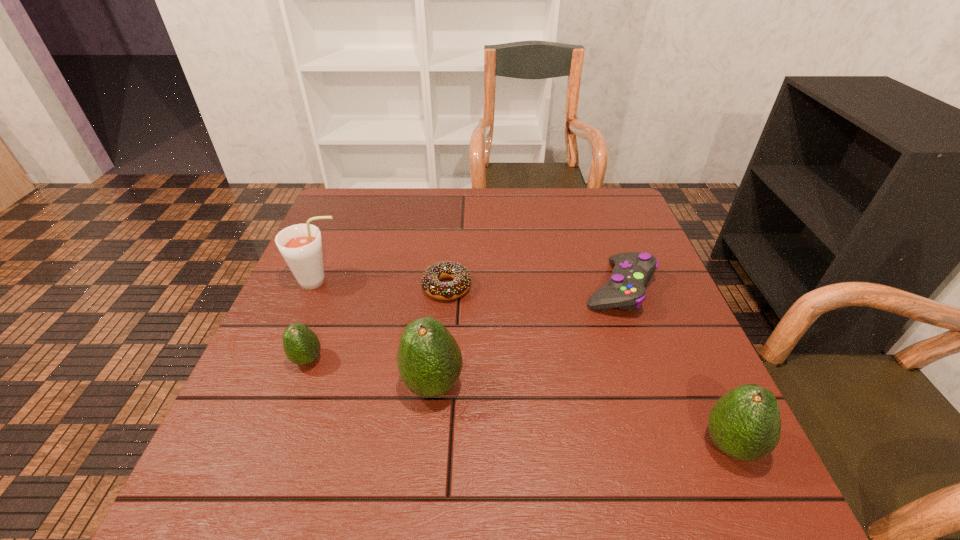
In the image, there is a desktop. Identify the location of free space at the near edge. This screenshot has width=960, height=540. (493, 412).

Image resolution: width=960 pixels, height=540 pixels. I want to click on free space at the left edge, so click(358, 267).

Where is `free space at the right edge of the desktop`? This screenshot has width=960, height=540. free space at the right edge of the desktop is located at coordinates (607, 234).

The width and height of the screenshot is (960, 540). I want to click on free space at the far left corner of the desktop, so click(353, 228).

Identify the location of free space at the far right corner of the desktop. The image size is (960, 540). (614, 209).

In order to click on vacant space that is in between the control and the second avocado from left to right in this screenshot , I will do `click(526, 336)`.

In order to click on vacant space that is in between the second shortest avocado and the second avocado from left to right in this screenshot , I will do `click(582, 415)`.

Image resolution: width=960 pixels, height=540 pixels. I want to click on vacant region between the root beer and the second avocado from left to right, so click(376, 333).

Find the location of a particular element. This screenshot has width=960, height=540. vacant space that is in between the rightmost avocado and the shortest object is located at coordinates (588, 366).

Image resolution: width=960 pixels, height=540 pixels. Find the location of `free space between the leftmost avocado and the doughnut`. free space between the leftmost avocado and the doughnut is located at coordinates (377, 323).